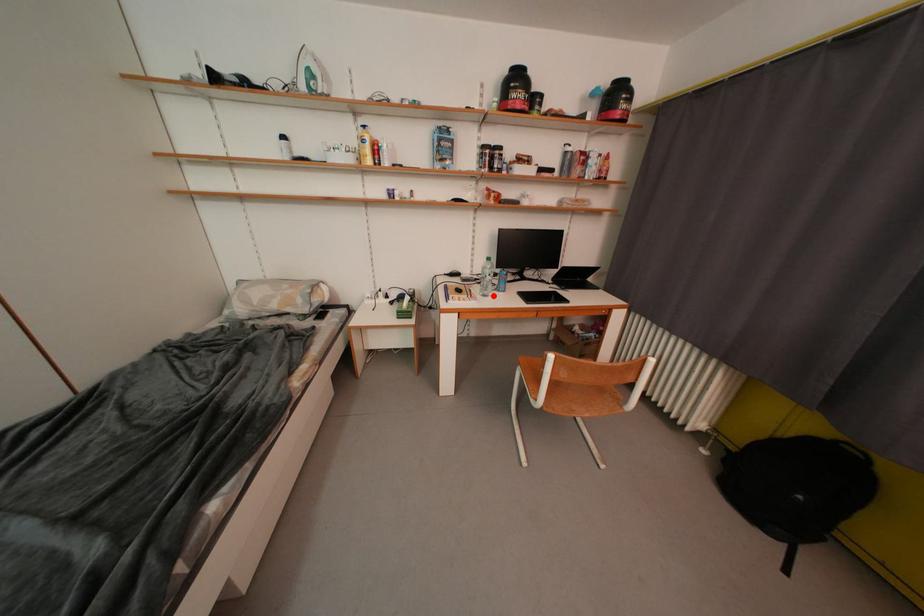
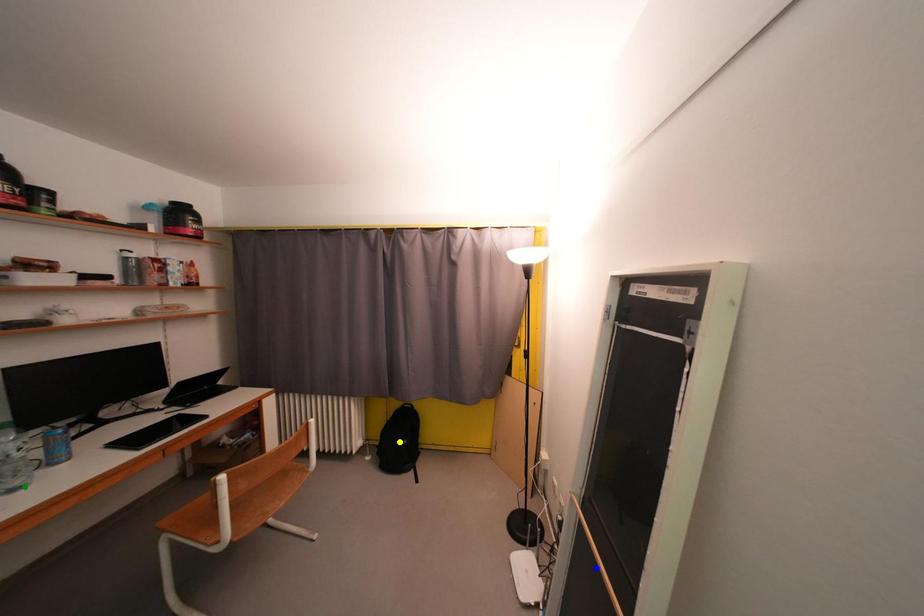
Question: I am providing you with two images of the same scene from different viewpoints. A red point is marked on the first image. You are given multiple points on the second image. Which point in image 2 represents the same 3d spot as the red point in image 1?

Choices:
 (A) green point
 (B) yellow point
 (C) blue point

Answer: (A)